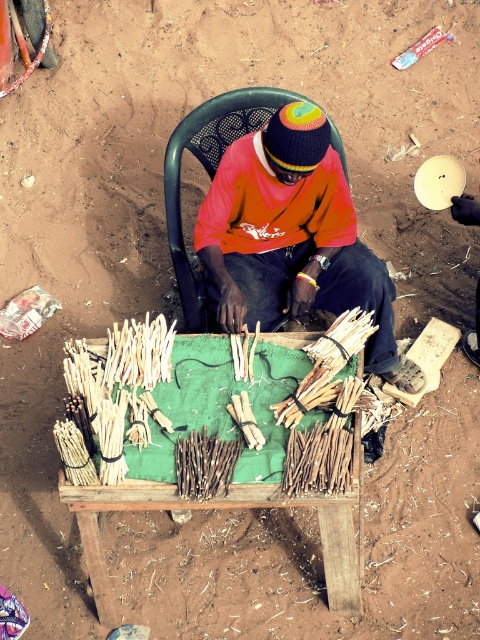
You are a delivery robot with a 3.5 feet wide package. You need to navigate between the black plastic chair at center and the brown natural reed at center to deliver the package. Can you fit through the space between them?

The black plastic chair at center and brown natural reed at center are 4.55 feet apart from each other. Since the package is 3.5 feet wide, the robot can fit through the space between them as the distance is wider than the package.

You are planning to place a small potted plant between the black plastic chair at center and the brown natural reed at center. Which object should the plant be closer to if you want it to be near the smaller one?

The brown natural reed at center is smaller than the black plastic chair at center, so the plant should be placed closer to the brown natural reed at center.